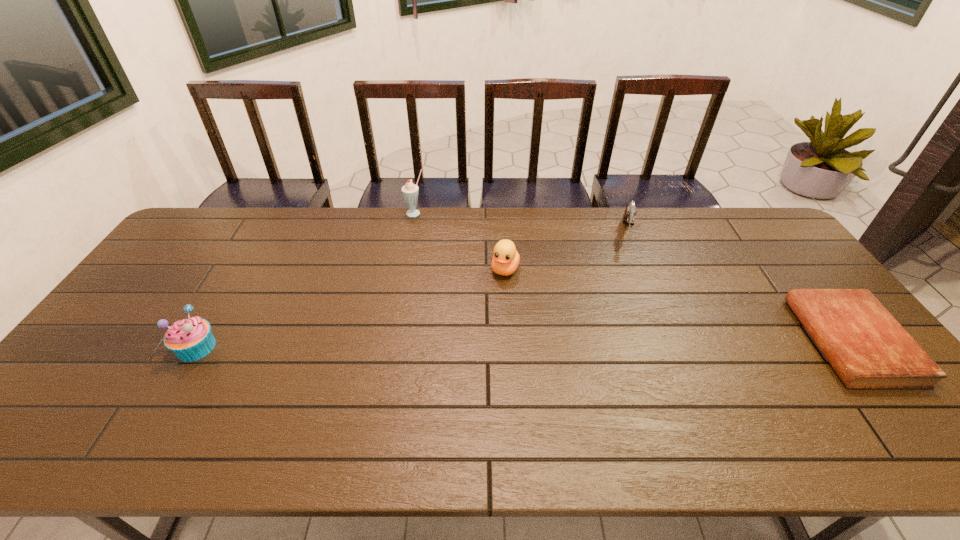
Where is `vacant space on the desktop that is between the muffin and the rightmost object and is positioned on the straw side of the milkshake`? vacant space on the desktop that is between the muffin and the rightmost object and is positioned on the straw side of the milkshake is located at coordinates (462, 345).

Find the location of a particular element. vacant space on the desktop that is between the leftmost object and the shortest object and is positioned at the barrel of the fourth object from left to right is located at coordinates (623, 343).

What are the coordinates of `vacant space on the desktop that is between the leftmost object and the shortest object and is positioned on the face of the duckling` in the screenshot? It's located at (474, 345).